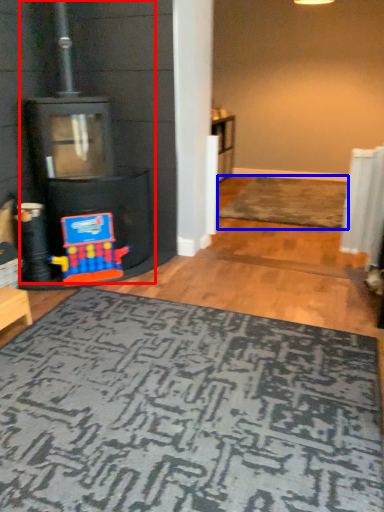
Question: Which object is closer to the camera taking this photo, fireplace (highlighted by a red box) or doormat (highlighted by a blue box)?

Choices:
 (A) fireplace
 (B) doormat

Answer: (A)